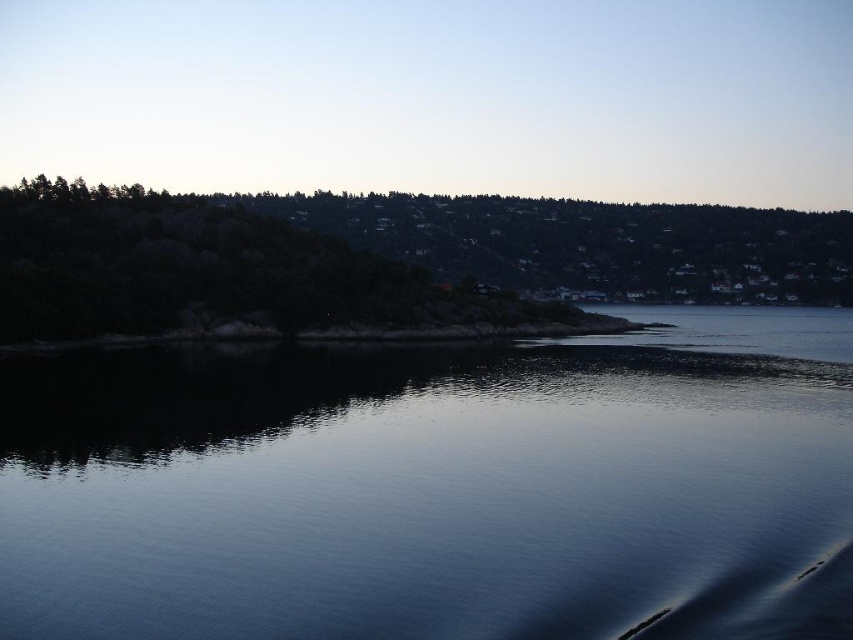
Question: Is dark reflective water at center smaller than green textured rock at upper center?

Choices:
 (A) no
 (B) yes

Answer: (B)

Question: Can you confirm if dark reflective water at center is thinner than green textured rock at upper center?

Choices:
 (A) no
 (B) yes

Answer: (B)

Question: Among these points, which one is nearest to the camera?

Choices:
 (A) (718, 324)
 (B) (834, 273)

Answer: (A)

Question: Is dark reflective water at center closer to camera compared to green textured rock at upper center?

Choices:
 (A) yes
 (B) no

Answer: (A)

Question: Which point is closer to the camera?

Choices:
 (A) green textured rock at upper center
 (B) dark reflective water at center

Answer: (B)